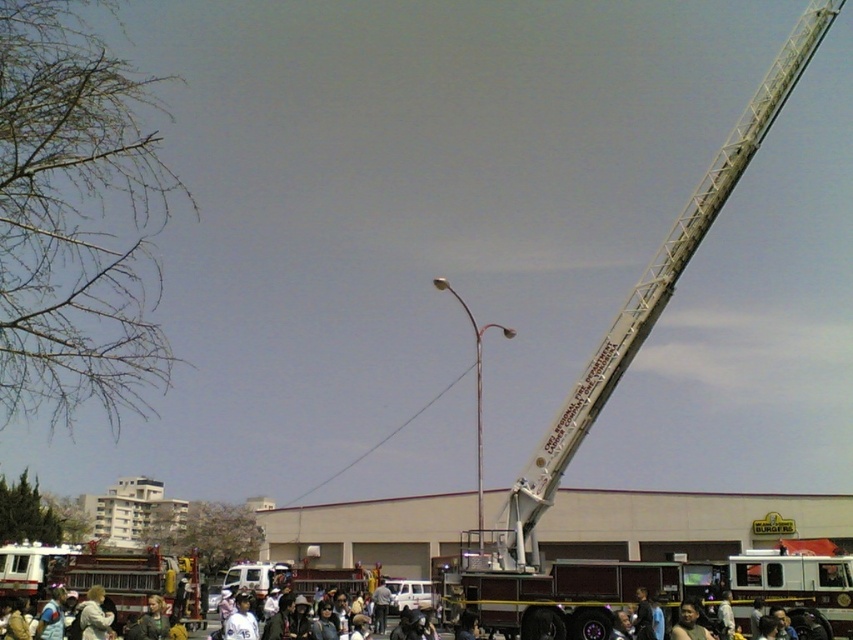
You are standing at the origin point of the image coordinate system. You want to move towards the white fabric jacket at lower center. Which direction should you move in terms of x and y coordinates?

The white fabric jacket at lower center is located at point 0.963 in the x direction and 0.111 in the y direction. Therefore, you should move towards the right and slightly downward to reach it.

You are a photographer trying to capture a clear shot of the fire truck and its ladder. You notice two jackets in the foreground that might obstruct your view. Which jacket is closer to the camera, the white fabric jacket at lower center or the dark brown leather jacket at lower center?

The white fabric jacket at lower center is closer to the camera because it is located below the dark brown leather jacket at lower center, meaning it is in front of it.

You are a photographer trying to capture a clear shot of the dark brown leather jacket at lower center without the white fabric jacket at lower center blocking it. What adjustment should you make to your camera position?

Move your camera position closer to the dark brown leather jacket at lower center so that it comes into focus while the white fabric jacket at lower center moves out of the frame.